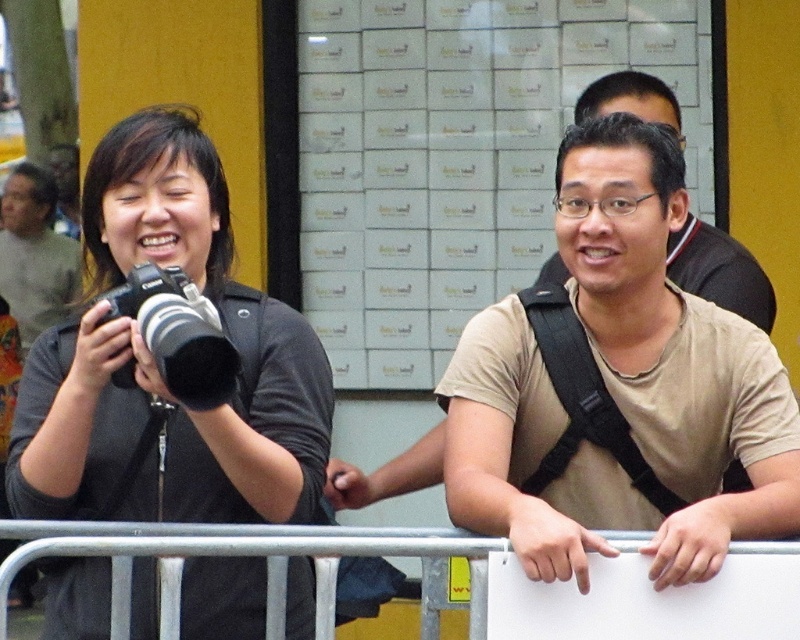
You are at a crowded event and need to locate the matte black camera at left and the gray sweater at left. Based on their positions, which object is closer to the center of the image?

The matte black camera at left is closer to the center of the image because it is positioned to the right of the gray sweater at left.

You are a photographer trying to position your matte black camera at left and black matte camera at left for a group photo. Since both cameras are similar, you need to ensure they are arranged properly. According to the scene, which camera is positioned to the left?

The matte black camera at left is positioned to the left of the black matte camera at left.

Looking at this image, you are standing in the scene and want to move from the point at coordinates point (152, 472) to the point at coordinates point (132, 356). Which direction should you move to get closer to the latter?

You should move towards the point at coordinates point (132, 356) by moving away from the viewer since point (152, 472) is further to the viewer than point (132, 356).